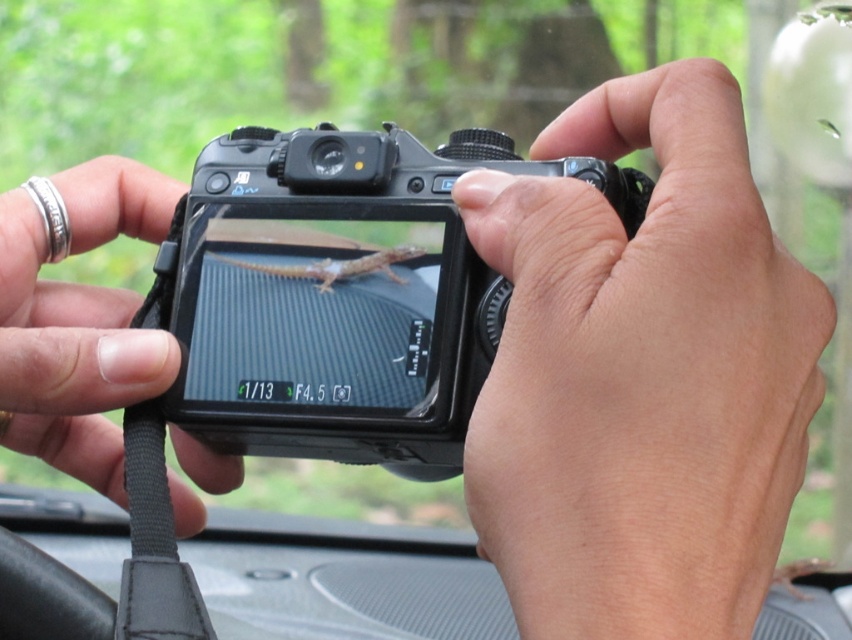
You are a photographer trying to adjust the settings on your camera. You notice the silver metallic ring at upper left and the black matte camera at center. Which object is closer to you?

The silver metallic ring at upper left is behind the black matte camera at center, so the black matte camera at center is closer to you.

You are a photographer trying to determine the best way to stabilize the black matte camera at center and the silver metallic ring at upper left. Since you need to know which one is taller, which object should you focus on stabilizing first?

The silver metallic ring at upper left is taller than the black matte camera at center, so you should focus on stabilizing the silver metallic ring at upper left first to ensure both objects are properly supported.